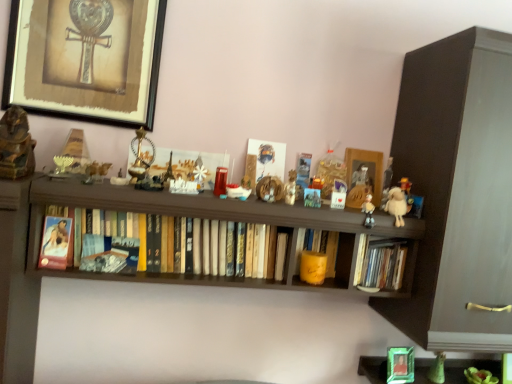
Question: Is wooden picture frame at center, the 2th picture frame when ordered from front to back, bigger than metallic framed artwork at upper left, which is counted as the second picture frame, starting from the back?

Choices:
 (A) yes
 (B) no

Answer: (B)

Question: Can you confirm if wooden picture frame at center, which ranks as the first picture frame in right-to-left order, is thinner than metallic framed artwork at upper left, positioned as the 1th picture frame in top-to-bottom order?

Choices:
 (A) no
 (B) yes

Answer: (B)

Question: Could metallic framed artwork at upper left, arranged as the 2th picture frame when viewed from the right, be considered to be inside wooden picture frame at center, which appears as the first picture frame when ordered from the bottom?

Choices:
 (A) no
 (B) yes

Answer: (A)

Question: Is wooden picture frame at center, acting as the second picture frame starting from the top, in front of metallic framed artwork at upper left, positioned as the 1th picture frame in top-to-bottom order?

Choices:
 (A) yes
 (B) no

Answer: (B)

Question: Is wooden picture frame at center, the second picture frame in the left-to-right sequence, next to metallic framed artwork at upper left, which is counted as the 2th picture frame, starting from the bottom?

Choices:
 (A) no
 (B) yes

Answer: (A)

Question: Do you think yellow matte candle at center, which is counted as the 2th book, starting from the right, is within hardcover books at center, which is the third book from right to left, or outside of it?

Choices:
 (A) outside
 (B) inside

Answer: (A)

Question: Does point (332, 266) appear closer or farther from the camera than point (142, 215)?

Choices:
 (A) farther
 (B) closer

Answer: (A)

Question: In terms of height, does yellow matte candle at center, which is counted as the 2th book, starting from the left, look taller or shorter compared to hardcover books at center, which is the third book from right to left?

Choices:
 (A) short
 (B) tall

Answer: (A)

Question: From the image's perspective, is yellow matte candle at center, which is counted as the 2th book, starting from the left, above or below hardcover books at center, which is the third book from right to left?

Choices:
 (A) above
 (B) below

Answer: (B)

Question: Do you think metallic framed artwork at upper left, which is counted as the first picture frame, starting from the left, is within matte paper photo frame at left, or outside of it?

Choices:
 (A) outside
 (B) inside

Answer: (A)

Question: In the image, is metallic framed artwork at upper left, arranged as the 2th picture frame when viewed from the right, on the left side or the right side of matte paper photo frame at left?

Choices:
 (A) right
 (B) left

Answer: (A)

Question: From a real-world perspective, is metallic framed artwork at upper left, positioned as the 1th picture frame in top-to-bottom order, positioned above or below matte paper photo frame at left?

Choices:
 (A) above
 (B) below

Answer: (A)

Question: Is metallic framed artwork at upper left, the first picture frame viewed from the front, bigger or smaller than matte paper photo frame at left?

Choices:
 (A) small
 (B) big

Answer: (B)

Question: From a real-world perspective, relative to hardcover books at center, which is the third book from right to left, is fluffy beige stuffed animal at right vertically above or below?

Choices:
 (A) below
 (B) above

Answer: (B)

Question: Considering the relative positions of fluffy beige stuffed animal at right and hardcover books at center, the 1th book positioned from the left, in the image provided, is fluffy beige stuffed animal at right to the left or to the right of hardcover books at center, the 1th book positioned from the left,?

Choices:
 (A) right
 (B) left

Answer: (A)